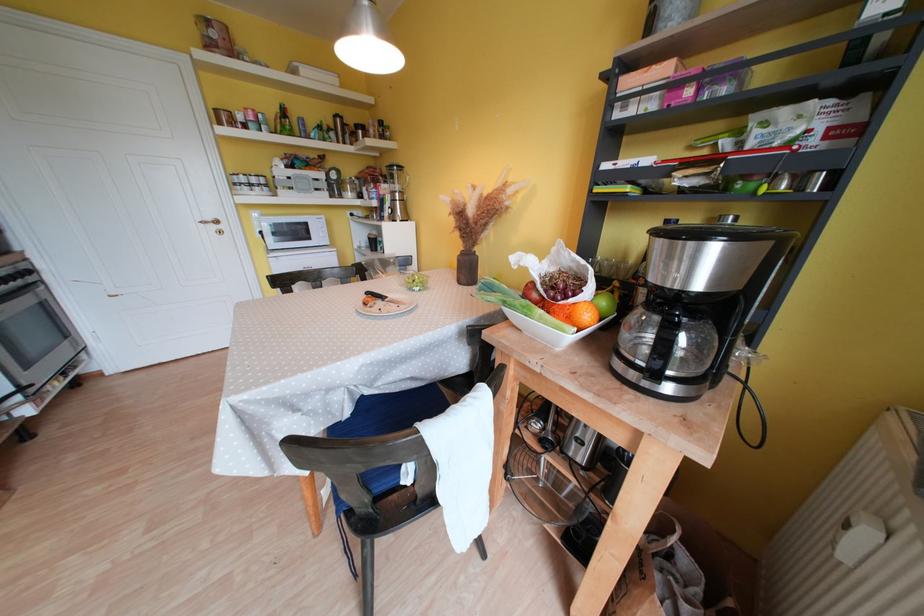
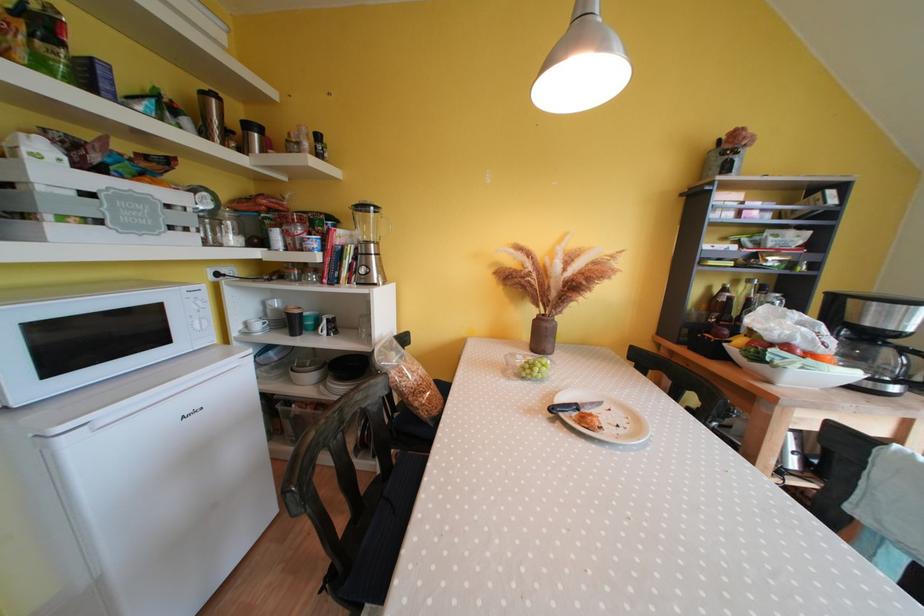
The point at (342, 120) is marked in the first image. Where is the corresponding point in the second image?

(209, 98)